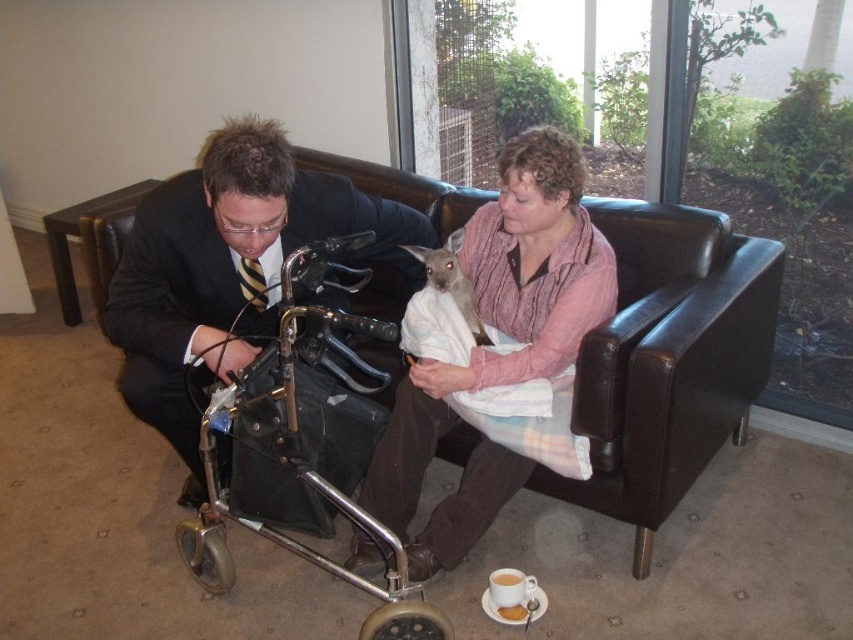
Which is behind, point (582, 493) or point (480, 368)?

Point (582, 493)

Where is `black leather couch at center`? black leather couch at center is located at coordinates (668, 360).

This screenshot has width=853, height=640. I want to click on black leather couch at center, so click(x=668, y=360).

Locate an element on the screen. black leather couch at center is located at coordinates (668, 360).

Find the location of a particular element. pink cotton shirt at upper center is located at coordinates (515, 296).

Which of these two, black leather couch at center or metallic silver walker at lower left, stands taller?

Standing taller between the two is black leather couch at center.

Is black leather couch at center positioned before metallic silver walker at lower left?

No, black leather couch at center is behind metallic silver walker at lower left.

Is point (660, 486) less distant than point (199, 428)?

That is True.

The width and height of the screenshot is (853, 640). In order to click on black leather couch at center in this screenshot , I will do `click(668, 360)`.